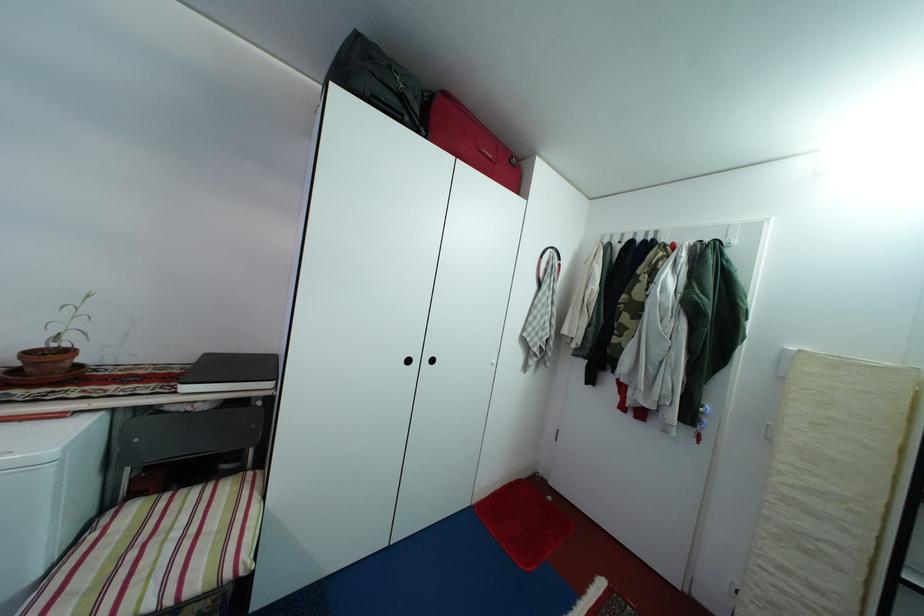
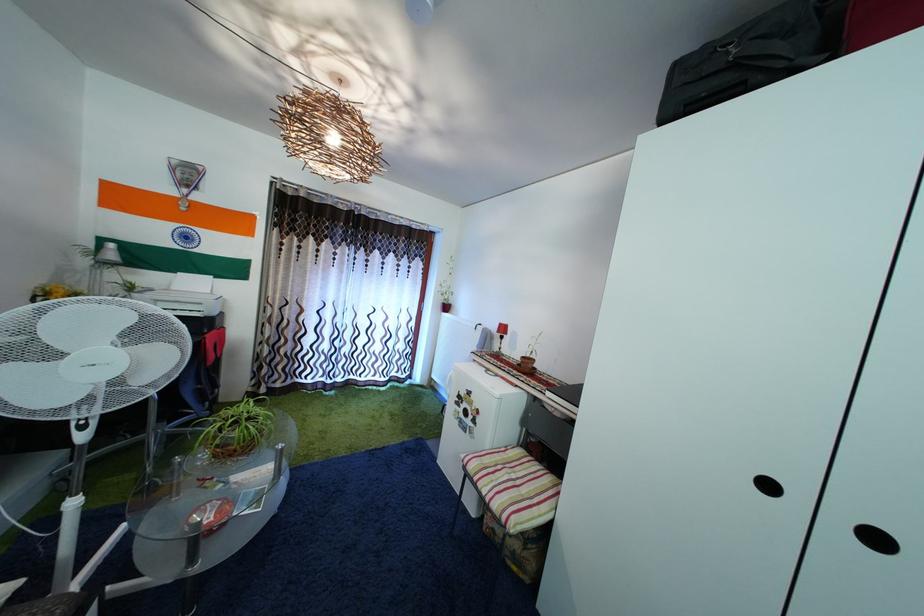
Question: The camera is either moving clockwise (left) or counter-clockwise (right) around the object. The first image is from the beginning of the video and the second image is from the end. Is the camera moving left or right when shooting the video?

Choices:
 (A) Left
 (B) Right

Answer: (B)